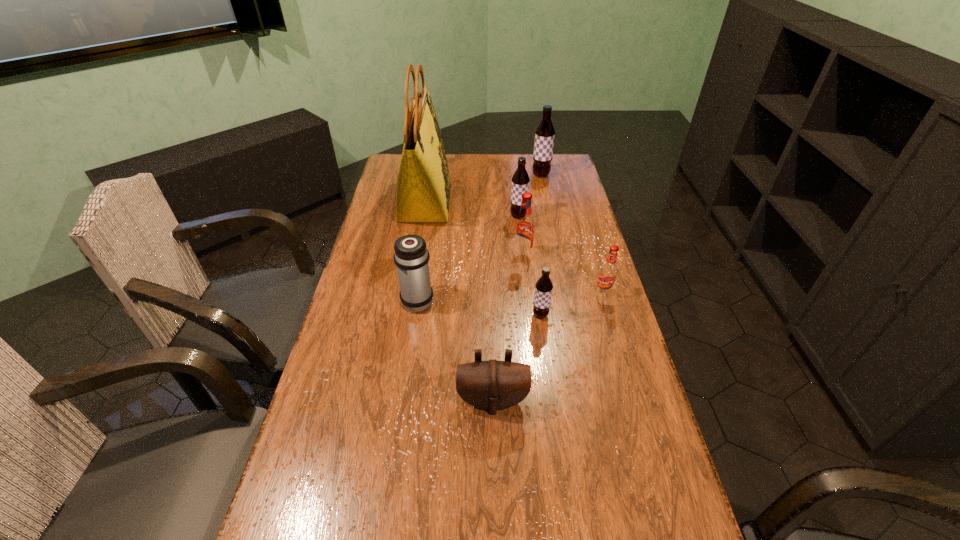
At what (x,y) coordinates should I click in order to perform the action: click on the smaller red root beer. Please return your answer as a coordinate pair (x, y). Looking at the image, I should click on (608, 272).

Find the location of a particular element. the nearest root beer is located at coordinates (543, 288).

Where is `the nearest brown root beer`? The width and height of the screenshot is (960, 540). the nearest brown root beer is located at coordinates (543, 288).

Find the location of a particular element. The image size is (960, 540). the shortest object is located at coordinates (493, 385).

This screenshot has height=540, width=960. What are the coordinates of `brown pouch` in the screenshot? It's located at pyautogui.click(x=493, y=385).

At what (x,y) coordinates should I click in order to perform the action: click on vacant position located on the front-facing side of the yellow tote bag. Please return your answer as a coordinate pair (x, y). Image resolution: width=960 pixels, height=540 pixels. Looking at the image, I should click on (533, 202).

At what (x,y) coordinates should I click in order to perform the action: click on blank area located on the front of the fourth root beer from left to right. Please return your answer as a coordinate pair (x, y). The width and height of the screenshot is (960, 540). Looking at the image, I should click on (546, 201).

Locate an element on the screen. vacant space located on the back of the fourth farthest object is located at coordinates (517, 212).

Identify the location of free space located 0.200m on the back of the second biggest brown root beer. (515, 185).

At what (x,y) coordinates should I click in order to perform the action: click on free space located 0.070m on the side with the handle of the thermos bottle. Please return your answer as a coordinate pair (x, y). Image resolution: width=960 pixels, height=540 pixels. Looking at the image, I should click on (421, 272).